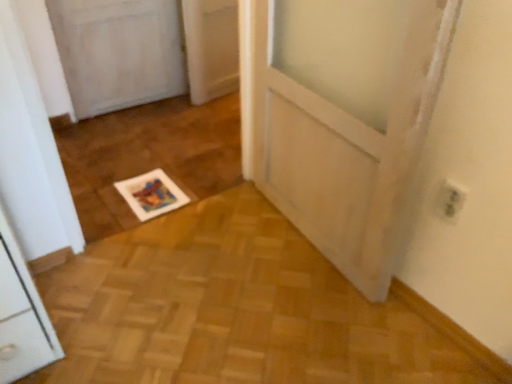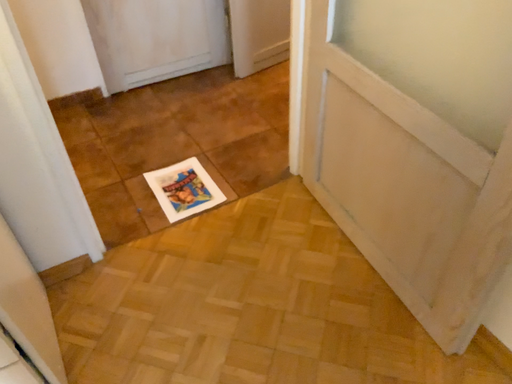
Question: Which way did the camera rotate in the video?

Choices:
 (A) rotated left
 (B) rotated right

Answer: (A)